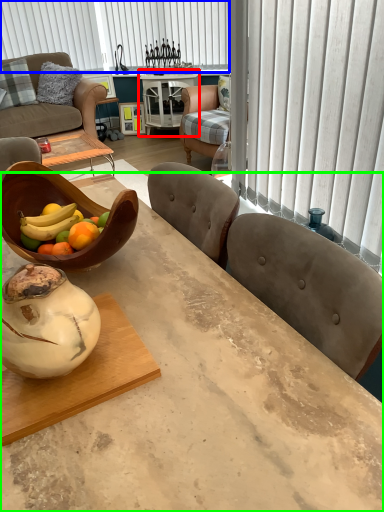
Question: Which is nearer to the round table (highlighted by a red box)? blind (highlighted by a blue box) or desk (highlighted by a green box).

Choices:
 (A) blind
 (B) desk

Answer: (A)